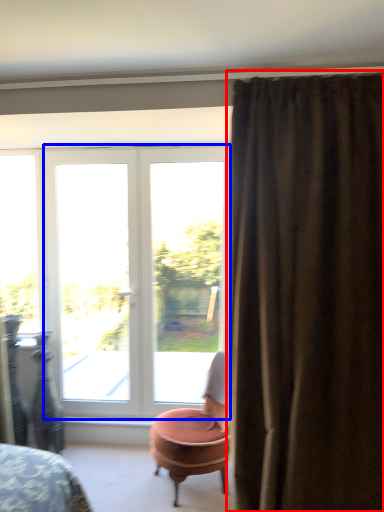
Question: Which object appears closest to the camera in this image, curtain (highlighted by a red box) or door (highlighted by a blue box)?

Choices:
 (A) curtain
 (B) door

Answer: (A)